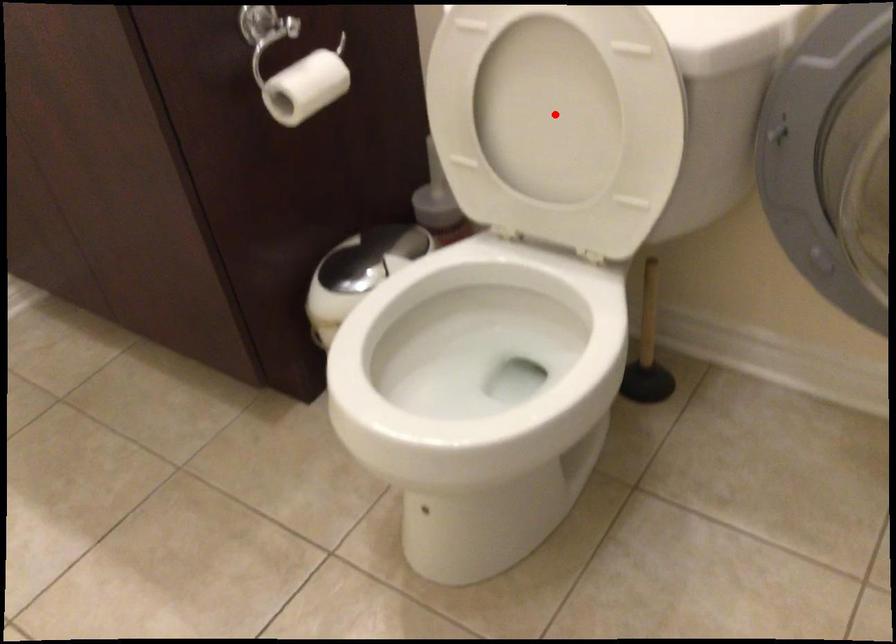
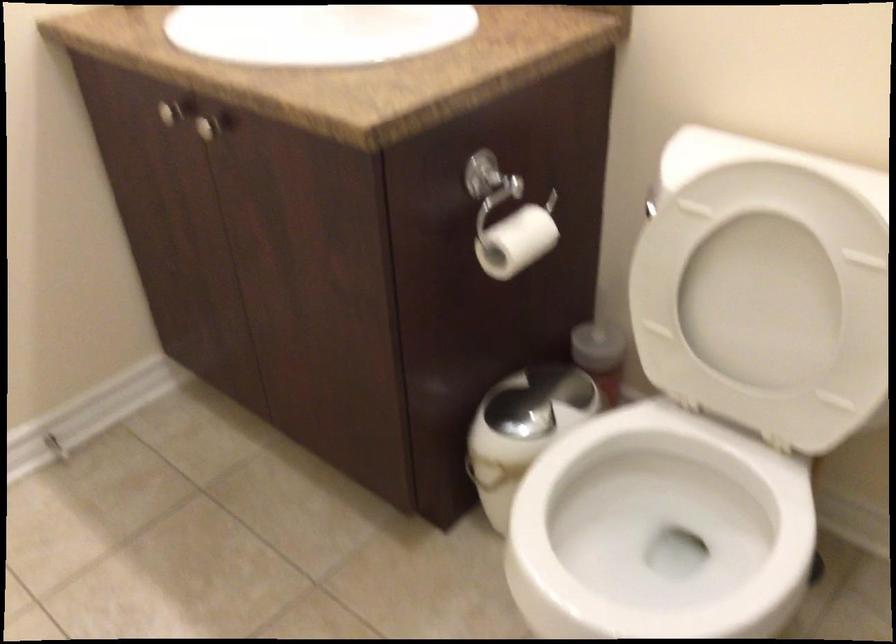
The point at the highlighted location is marked in the first image. Where is the corresponding point in the second image?

(763, 299)